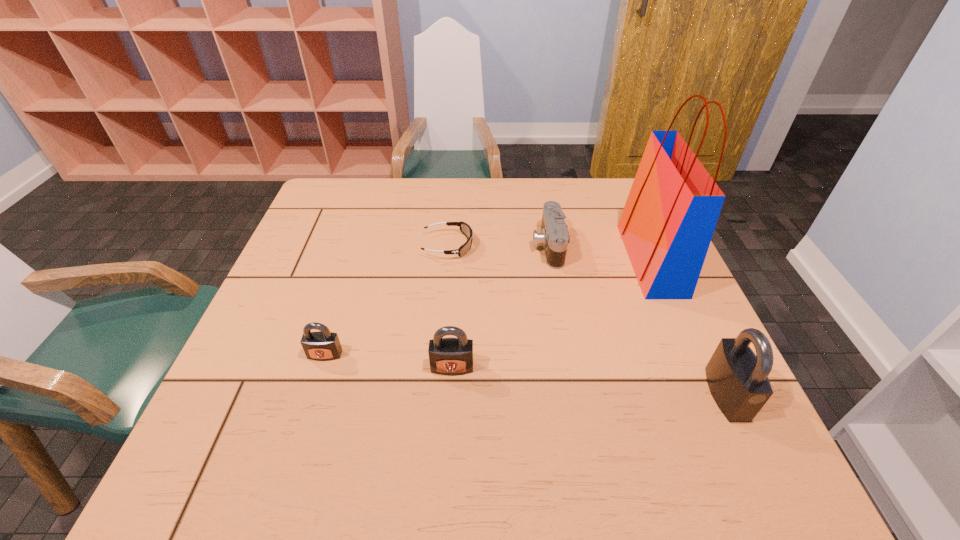
To achieve even spacing by inserting another padlock among them, please point to a vacant spot for this new padlock. Please provide its 2D coordinates. Your answer should be formatted as a tuple, i.e. [(x, y)], where the tuple contains the x and y coordinates of a point satisfying the conditions above.

[(587, 380)]